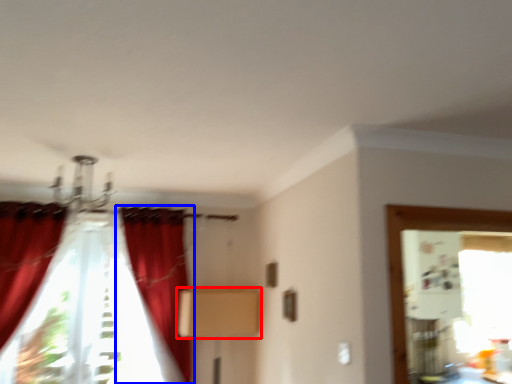
Question: Which object appears farthest to the camera in this image, cardboard box (highlighted by a red box) or curtain (highlighted by a blue box)?

Choices:
 (A) cardboard box
 (B) curtain

Answer: (A)